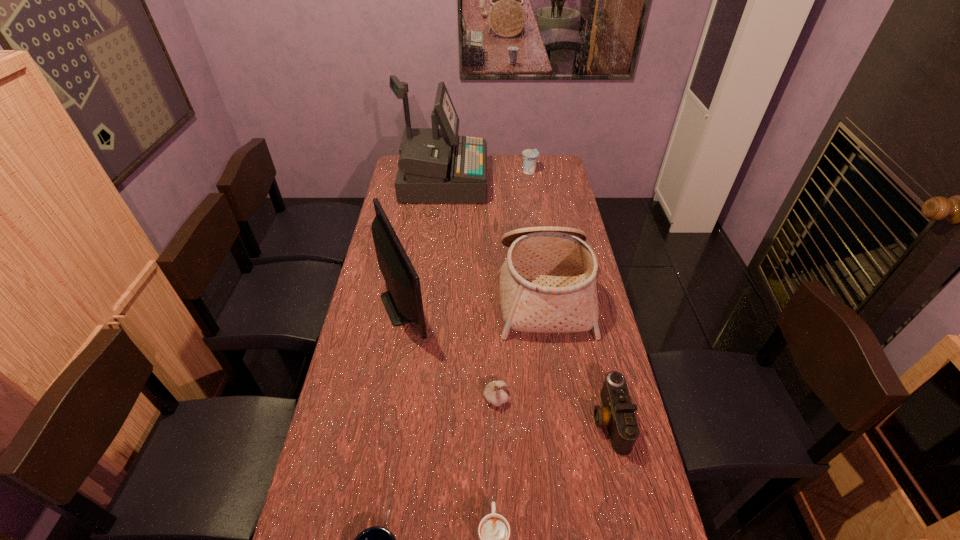
The width and height of the screenshot is (960, 540). I want to click on free region located with the lid open on the basket, so click(424, 291).

You are a GUI agent. You are given a task and a screenshot of the screen. Output one action in this format:
    pyautogui.click(x=<x>, y=<y>)
    Task: Click on the vacant space situated on the front of the yogurt
    The height and width of the screenshot is (540, 960).
    Given the screenshot: What is the action you would take?
    pyautogui.click(x=532, y=193)

You are a GUI agent. You are given a task and a screenshot of the screen. Output one action in this format:
    pyautogui.click(x=<x>, y=<y>)
    Task: Click on the vacant region located 0.360m on the lens of the camera
    
    Given the screenshot: What is the action you would take?
    pyautogui.click(x=466, y=420)

Locate an element on the screen. The height and width of the screenshot is (540, 960). blank space located on the lens of the camera is located at coordinates (546, 420).

Locate an element on the screen. Image resolution: width=960 pixels, height=540 pixels. blank space located on the lens of the camera is located at coordinates (521, 420).

Where is `vacant space located on the left of the garlic`? The image size is (960, 540). vacant space located on the left of the garlic is located at coordinates coord(439,398).

Identify the location of cash register that is at the far edge. The image size is (960, 540). (436, 165).

This screenshot has width=960, height=540. Identify the location of yogurt present at the far edge. (530, 156).

At what (x,y) coordinates should I click in order to perform the action: click on cash register situated at the left edge. Please return your answer as a coordinate pair (x, y). The height and width of the screenshot is (540, 960). Looking at the image, I should click on (436, 165).

Image resolution: width=960 pixels, height=540 pixels. I want to click on computer monitor positioned at the left edge, so click(x=403, y=302).